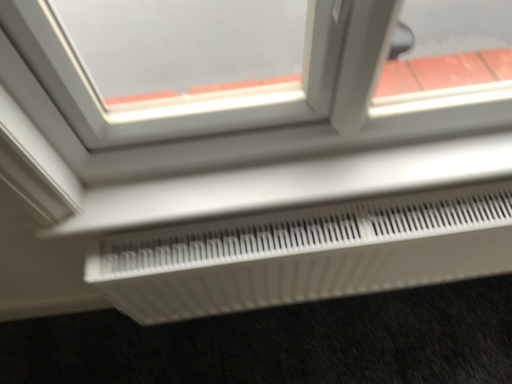
This screenshot has width=512, height=384. What are the coordinates of `free spot above white plastic radiator at lower center (from a real-world perspective)` in the screenshot? It's located at (284, 154).